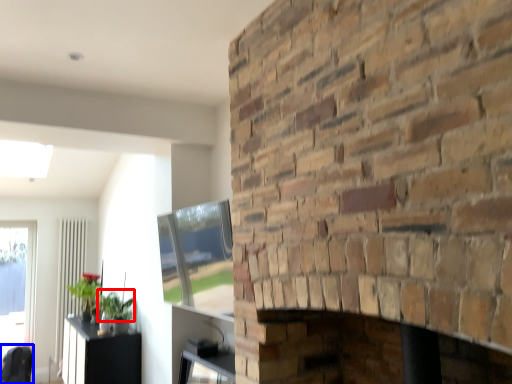
Question: Which object appears closest to the camera in this image, plant (highlighted by a red box) or swivel chair (highlighted by a blue box)?

Choices:
 (A) plant
 (B) swivel chair

Answer: (A)